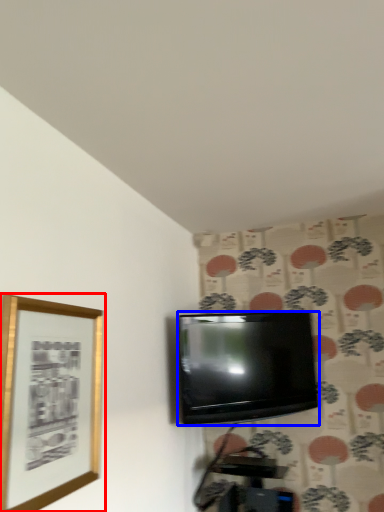
Question: Which object appears closest to the camera in this image, picture frame (highlighted by a red box) or television (highlighted by a blue box)?

Choices:
 (A) picture frame
 (B) television

Answer: (A)